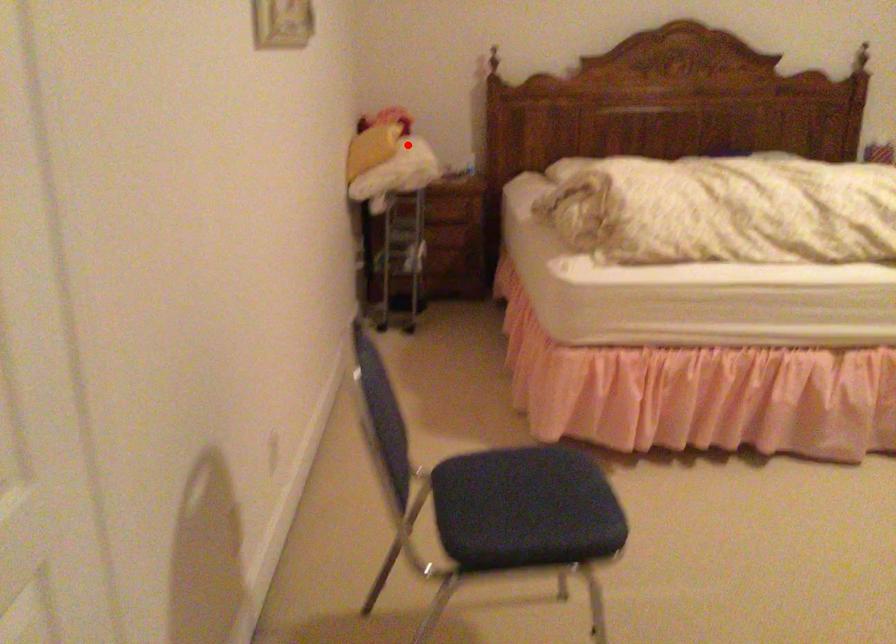
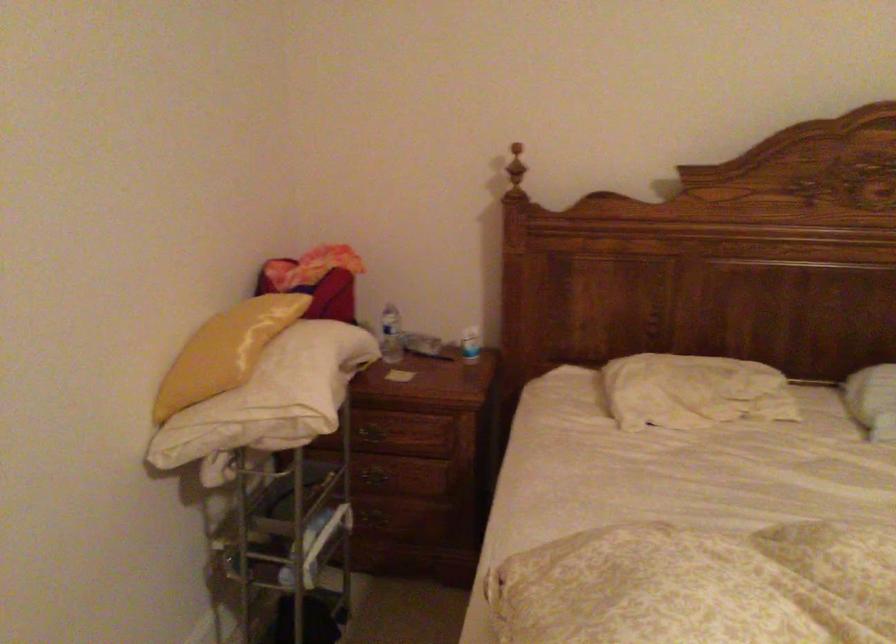
Find the pixel in the second image that matches the highlighted location in the first image.

(287, 375)